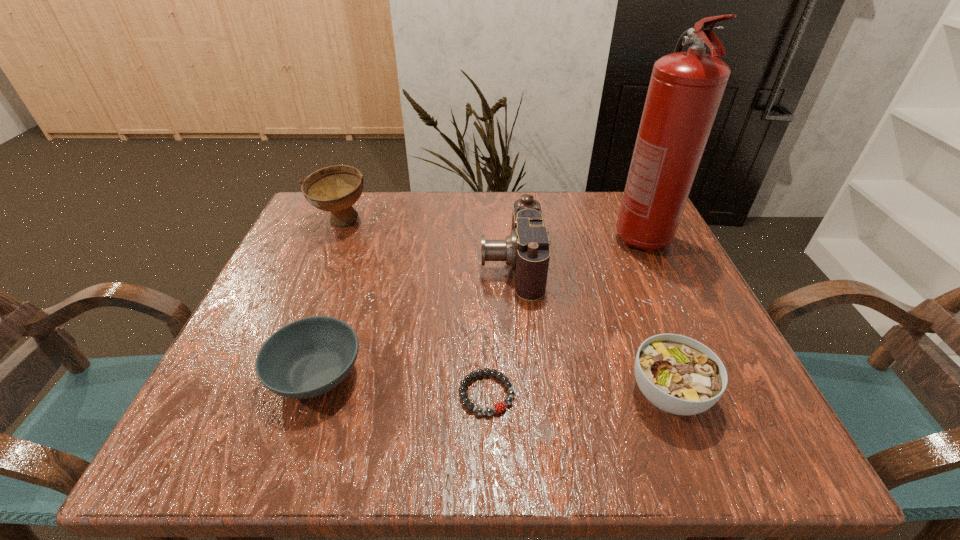
Select which object appears as the closest to the camera. Please provide its 2D coordinates. Your answer should be formatted as a tuple, i.e. [(x, y)], where the tuple contains the x and y coordinates of a point satisfying the conditions above.

[(498, 407)]

The height and width of the screenshot is (540, 960). I want to click on the third closest object to the bracelet, so click(x=679, y=375).

Locate which soup bowl ranks in proximity to the shortest soup bowl. Please provide its 2D coordinates. Your answer should be formatted as a tuple, i.e. [(x, y)], where the tuple contains the x and y coordinates of a point satisfying the conditions above.

[(334, 189)]

The image size is (960, 540). Find the location of `the third closest soup bowl to the camera`. the third closest soup bowl to the camera is located at coordinates (334, 189).

In order to click on vacant point that satisfies the following two spatial constraints: 1. on the front side of the farthest soup bowl; 2. on the right side of the shortest object in this screenshot , I will do (269, 394).

Find the location of `free space that satisfies the following two spatial constraints: 1. on the handle side the tallest object; 2. on the front-facing side of the camera`. free space that satisfies the following two spatial constraints: 1. on the handle side the tallest object; 2. on the front-facing side of the camera is located at coordinates (653, 264).